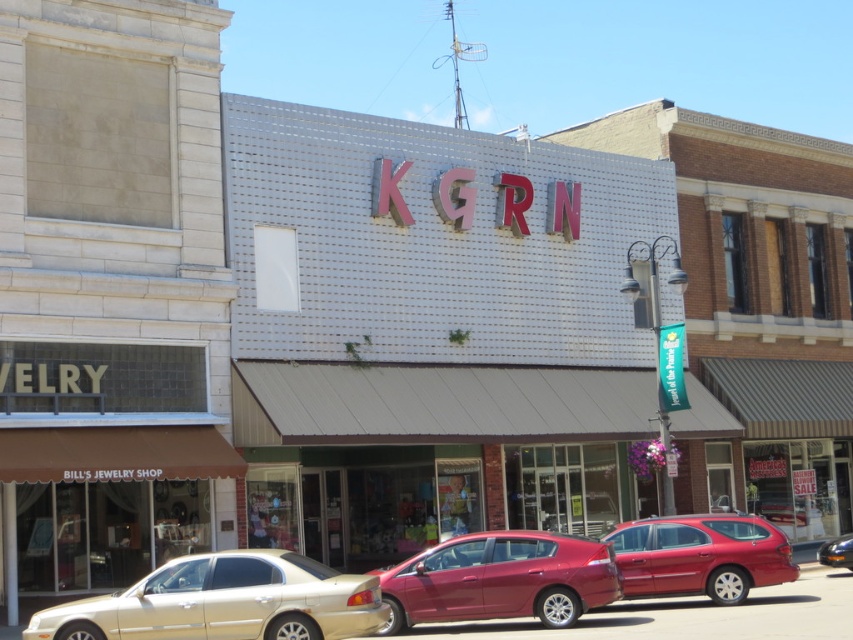
You are standing in the street scene and want to know which of the two points, point (223, 572) or point (618, 540), is nearer to you. Can you determine this based on the image?

Point (223, 572) is closer to the camera than point (618, 540), so it is the nearer one.

In the scene shown: You are standing on the sidewalk in front of the KGRN store and want to cross the street to the other side. The crosswalk is 25 meters away. Can you walk from your current position to the crosswalk without needing to move the glossy red sedan at center?

The glossy red sedan at center is 21.71 meters from the viewer, which is closer than the 25 meter distance to the crosswalk. Therefore, you can walk to the crosswalk without moving the car.

You are standing at the intersection and see the gold metallic sedan at lower left. A pedestrian is pointing to a specific location marked by point (225, 602). Is this point located on the gold metallic sedan at lower left?

Yes, the point (225, 602) is located on the gold metallic sedan at lower left.